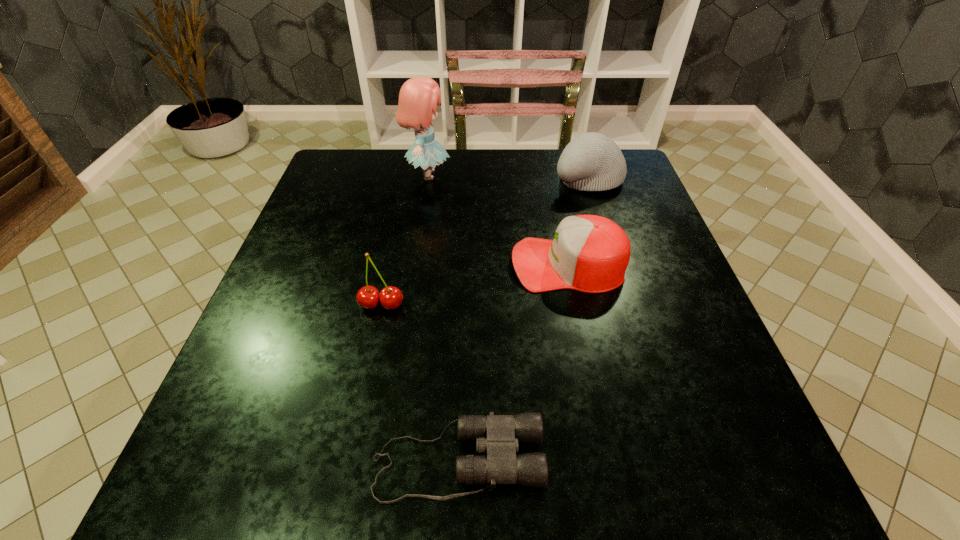
Identify the location of vacant space located 0.110m on the front-facing side of the third nearest object. (461, 264).

Locate an element on the screen. vacant space located 0.390m on the front-facing side of the third nearest object is located at coordinates (330, 264).

Where is `free region located 0.160m at the eyepiece of the shortest object`? free region located 0.160m at the eyepiece of the shortest object is located at coordinates (651, 460).

Image resolution: width=960 pixels, height=540 pixels. Identify the location of doll that is at the far edge. (418, 97).

The image size is (960, 540). I want to click on beanie present at the far edge, so click(592, 161).

Image resolution: width=960 pixels, height=540 pixels. Identify the location of object at the near edge. (498, 435).

At what (x,y) coordinates should I click in order to perform the action: click on beanie at the right edge. Please return your answer as a coordinate pair (x, y). Image resolution: width=960 pixels, height=540 pixels. Looking at the image, I should click on (592, 161).

Where is `baseball cap that is at the right edge`? The height and width of the screenshot is (540, 960). baseball cap that is at the right edge is located at coordinates (x=589, y=253).

Locate an element on the screen. object located at the far right corner is located at coordinates (592, 161).

The width and height of the screenshot is (960, 540). In the image, there is a desktop. In order to click on vacant area at the far edge in this screenshot , I will do `click(544, 170)`.